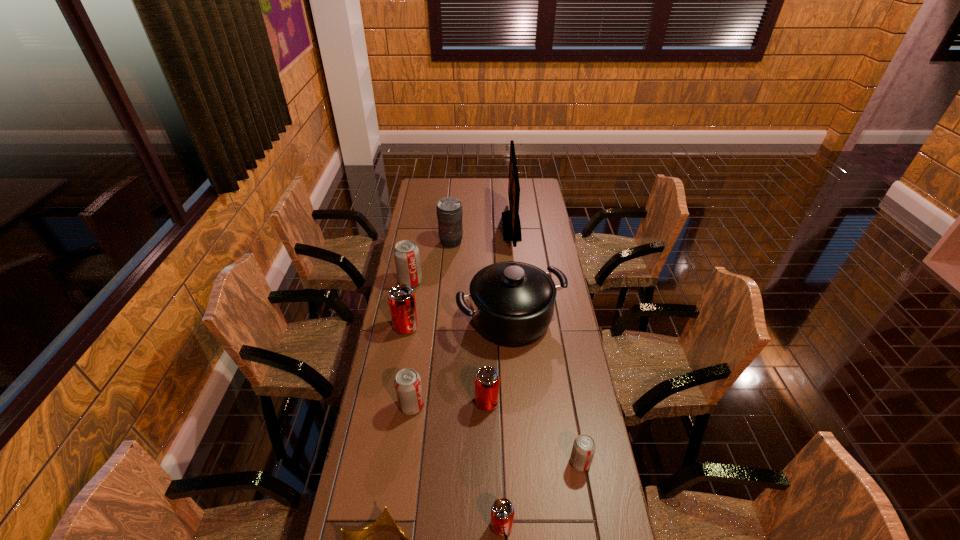
Identify the location of vacant point located 0.190m on the front of the second smallest gray soda can. (402, 475).

The width and height of the screenshot is (960, 540). Find the location of `vacant space located on the right of the second smallest red soda can`. vacant space located on the right of the second smallest red soda can is located at coordinates (535, 403).

Identify the location of free space located 0.330m on the back of the nearest soda can. The width and height of the screenshot is (960, 540). (497, 408).

This screenshot has height=540, width=960. In order to click on free space located on the left of the eighth farthest object in this screenshot , I will do `click(483, 462)`.

Identify the location of monitor located at the right edge. The height and width of the screenshot is (540, 960). (511, 221).

I want to click on saucepan that is positioned at the right edge, so click(x=511, y=303).

The height and width of the screenshot is (540, 960). I want to click on soda can that is at the right edge, so tap(583, 450).

The height and width of the screenshot is (540, 960). I want to click on vacant space at the far edge of the desktop, so click(x=458, y=197).

Image resolution: width=960 pixels, height=540 pixels. Find the location of `vacant space at the left edge`. vacant space at the left edge is located at coordinates (430, 285).

The image size is (960, 540). What are the coordinates of `vacant space at the right edge of the desktop` in the screenshot? It's located at (523, 219).